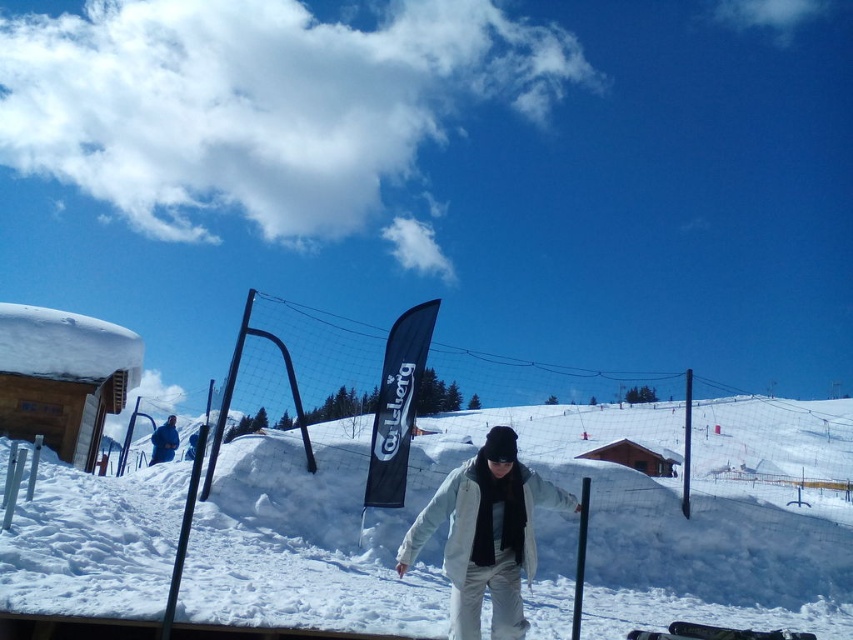
You are a photographer trying to capture the blue fabric jacket at lower left and the white fluffy snow at center in the same frame. Based on their positions, which object is closer to the camera?

The blue fabric jacket at lower left is closer to the camera because it is much shorter than the white fluffy snow at center, indicating proximity.

You are standing at the point with coordinates point (x=170, y=432) and want to walk towards the point with coordinates point (x=697, y=467). However, there is an obstacle blocking your path. Which direction should you move to avoid the obstacle while still heading towards your destination?

Since point (x=697, y=467) is behind point (x=170, y=432), you should move to the left or right to go around the obstacle and continue moving towards your destination.

You are a photographer trying to capture the entire scene in one shot. Given that the white fluffy snow at center and the blue fabric jacket at lower left are both in your frame, which object will require you to adjust your camera angle to include its full width?

The white fluffy snow at center has a larger width than the blue fabric jacket at lower left, so you will need to adjust your camera angle to include its full width.